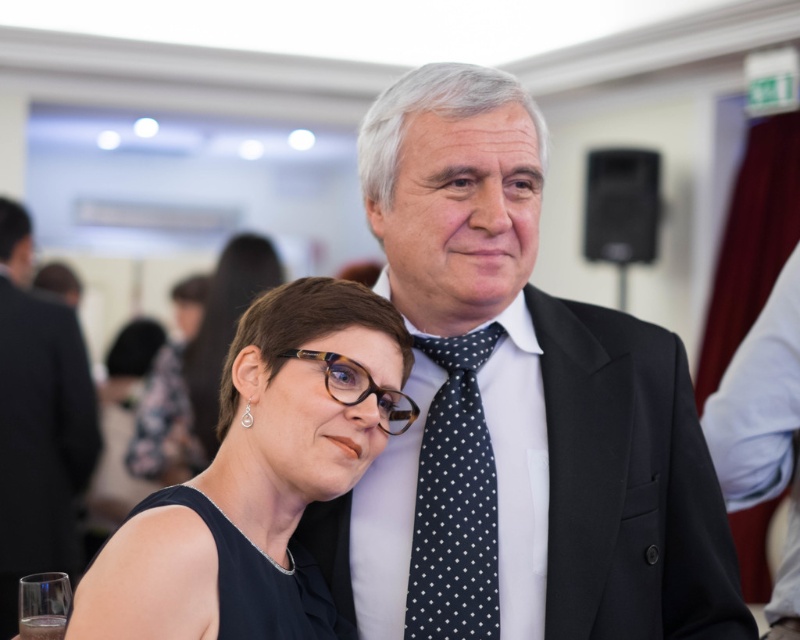
Question: Which of the following is the closest to the observer?

Choices:
 (A) (778, 394)
 (B) (440, 604)

Answer: (B)

Question: Is dark blue dotted tie at center bigger than brown tortoiseshell glasses at center?

Choices:
 (A) yes
 (B) no

Answer: (A)

Question: Which point is farther from the camera taking this photo?

Choices:
 (A) (454, 588)
 (B) (732, 412)
 (C) (204, 504)

Answer: (B)

Question: Which of the following is the closest to the observer?

Choices:
 (A) black glossy dress at center
 (B) white polka dot tie at right
 (C) dark blue dotted tie at center
 (D) brown tortoiseshell glasses at center

Answer: (A)

Question: Can you confirm if polka dot tie at center is wider than black satin dress at lower left?

Choices:
 (A) no
 (B) yes

Answer: (B)

Question: Can you confirm if white polka dot tie at right is bigger than brown tortoiseshell glasses at center?

Choices:
 (A) no
 (B) yes

Answer: (B)